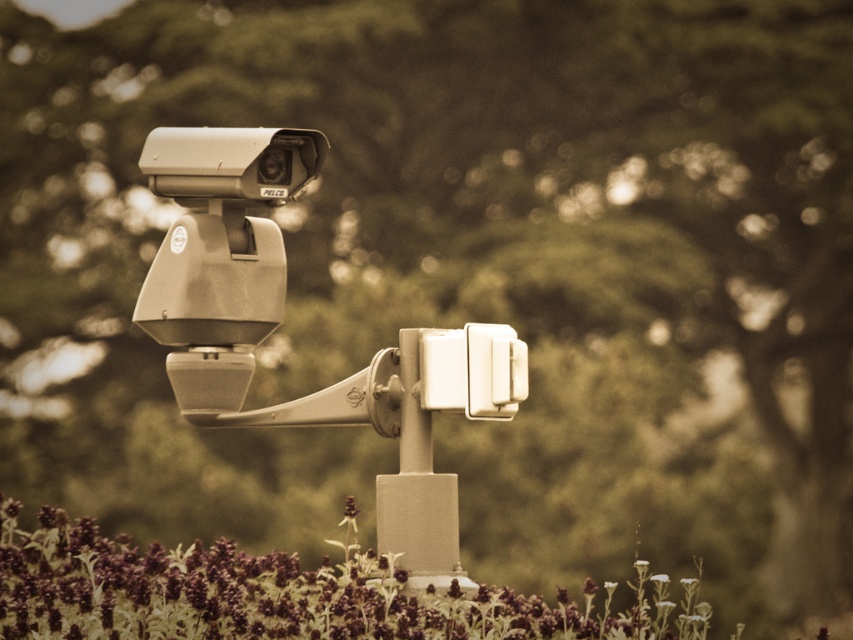
Question: Does purple matte flowers at lower center have a lesser width compared to metallic pole at center?

Choices:
 (A) no
 (B) yes

Answer: (A)

Question: Among these points, which one is nearest to the camera?

Choices:
 (A) (102, 608)
 (B) (181, 288)

Answer: (A)

Question: Is the position of matte gray security camera at center more distant than that of purple matte flowers at lower center?

Choices:
 (A) no
 (B) yes

Answer: (B)

Question: Which point is farther to the camera?

Choices:
 (A) (379, 493)
 (B) (196, 392)
 (C) (697, 582)

Answer: (B)

Question: Is matte gray security camera at center smaller than purple matte flowers at lower center?

Choices:
 (A) yes
 (B) no

Answer: (A)

Question: Which point is closer to the camera taking this photo?

Choices:
 (A) (19, 612)
 (B) (360, 378)
 (C) (383, 474)

Answer: (A)